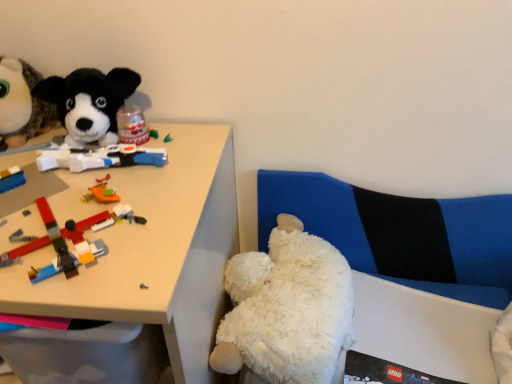
Question: Should I look upward or downward to see white fluffy teddy bear at lower right, the third toy viewed from the left?

Choices:
 (A) down
 (B) up

Answer: (A)

Question: Is white plush couch at lower right completely or partially outside of white plastic desk at upper left?

Choices:
 (A) yes
 (B) no

Answer: (A)

Question: From the image's perspective, does white plush couch at lower right appear higher than white plastic desk at upper left?

Choices:
 (A) yes
 (B) no

Answer: (A)

Question: Considering the relative sizes of white plush couch at lower right and white plastic desk at upper left in the image provided, is white plush couch at lower right smaller than white plastic desk at upper left?

Choices:
 (A) no
 (B) yes

Answer: (B)

Question: From a real-world perspective, does white plush couch at lower right stand above white plastic desk at upper left?

Choices:
 (A) yes
 (B) no

Answer: (A)

Question: Is the position of white plush couch at lower right less distant than that of white plastic desk at upper left?

Choices:
 (A) yes
 (B) no

Answer: (B)

Question: Considering the relative positions of white plush couch at lower right and white plastic desk at upper left in the image provided, is white plush couch at lower right to the right of white plastic desk at upper left from the viewer's perspective?

Choices:
 (A) yes
 (B) no

Answer: (A)

Question: From a real-world perspective, is black plush dog at upper left, acting as the 3th toy starting from the right, over brick-like plastic toys at left, which is the second toy from right to left?

Choices:
 (A) no
 (B) yes

Answer: (B)

Question: From a real-world perspective, is black plush dog at upper left, the 1th toy viewed from the top, beneath brick-like plastic toys at left, which is the second toy from right to left?

Choices:
 (A) no
 (B) yes

Answer: (A)

Question: Can you confirm if black plush dog at upper left, positioned as the 3th toy in bottom-to-top order, is smaller than brick-like plastic toys at left, placed as the 2th toy when sorted from bottom to top?

Choices:
 (A) no
 (B) yes

Answer: (A)

Question: Is black plush dog at upper left, the 1th toy viewed from the top, to the left of brick-like plastic toys at left, placed as the 2th toy when sorted from bottom to top, from the viewer's perspective?

Choices:
 (A) no
 (B) yes

Answer: (B)

Question: Would you say black plush dog at upper left, the 1th toy positioned from the left, is a long distance from brick-like plastic toys at left, placed as the 2th toy when sorted from bottom to top?

Choices:
 (A) yes
 (B) no

Answer: (B)

Question: Is black plush dog at upper left, the 1th toy viewed from the top, facing away from brick-like plastic toys at left, placed as the second toy when sorted from left to right?

Choices:
 (A) yes
 (B) no

Answer: (B)

Question: Is white plastic desk at upper left beside white plush couch at lower right?

Choices:
 (A) yes
 (B) no

Answer: (B)